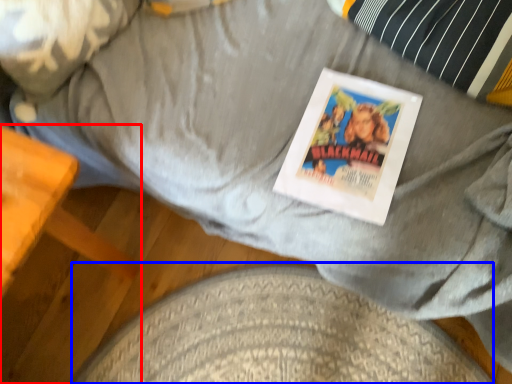
Question: Which object is closer to the camera taking this photo, furniture (highlighted by a red box) or dog bed (highlighted by a blue box)?

Choices:
 (A) furniture
 (B) dog bed

Answer: (A)